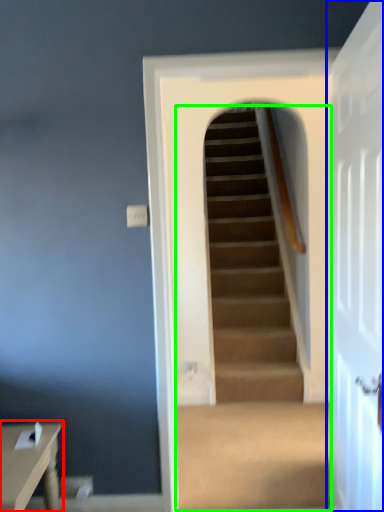
Question: Which object is the closest to the table (highlighted by a red box)? Choose among these: door (highlighted by a blue box) or escalator (highlighted by a green box).

Choices:
 (A) door
 (B) escalator

Answer: (A)